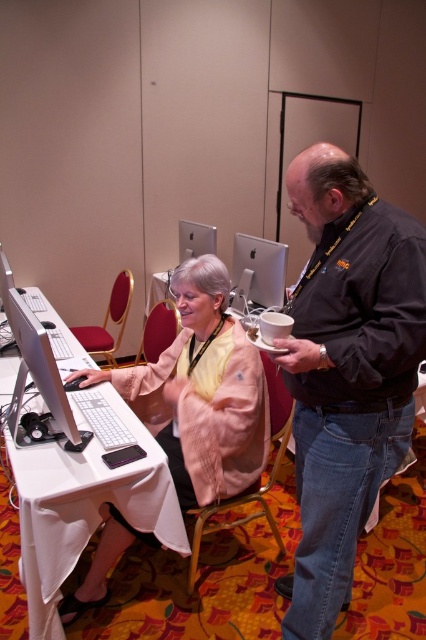
Is matte pink jacket at center closer to the viewer compared to white glossy monitor at center?

That is True.

Is matte pink jacket at center thinner than white glossy monitor at center?

Correct, matte pink jacket at center's width is less than white glossy monitor at center's.

Is point (307, 177) more distant than point (45, 349)?

No, (307, 177) is in front of (45, 349).

Where is `matte pink jacket at center`? The width and height of the screenshot is (426, 640). matte pink jacket at center is located at coordinates [x=347, y=371].

Is point (362, 508) less distant than point (69, 436)?

Yes.

Which is in front, point (406, 330) or point (19, 387)?

Point (406, 330) is in front.

At what (x,y) coordinates should I click in order to perform the action: click on dark gray shirt at center. Please return your answer as a coordinate pair (x, y). Looking at the image, I should click on (347, 371).

Is point (339, 381) closer to camera compared to point (161, 378)?

That is True.

Which is in front, point (313, 385) or point (180, 497)?

Point (313, 385)

Identify the location of matte pink jacket at center. (347, 371).